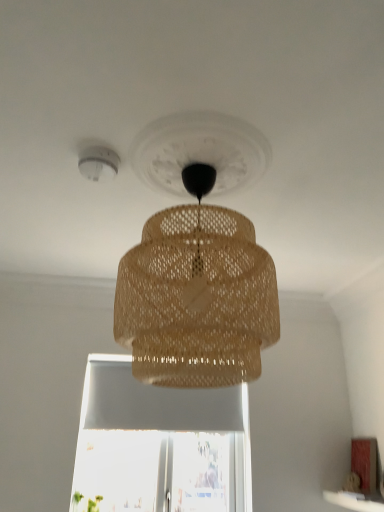
Image resolution: width=384 pixels, height=512 pixels. What do you see at coordinates (197, 295) in the screenshot?
I see `brown woven lampshade at center` at bounding box center [197, 295].

Identify the location of white matte window sill at lower right. (356, 501).

Identify the location of white plastic smoke detector at upper left. (98, 163).

From a real-world perspective, does brown woven lampshade at center stand above white matte window sill at lower right?

Yes, from a real-world perspective, brown woven lampshade at center is on top of white matte window sill at lower right.

Does point (249, 224) come in front of point (363, 508)?

Yes, point (249, 224) is in front of point (363, 508).

From the image's perspective, which one is positioned higher, white matte window sill at lower right or white plastic smoke detector at upper left?

white plastic smoke detector at upper left appears higher in the image.

From a real-world perspective, between white matte window sill at lower right and white plastic smoke detector at upper left, who is vertically higher?

white plastic smoke detector at upper left, from a real-world perspective.

Considering the sizes of white matte window sill at lower right and white plastic smoke detector at upper left in the image, is white matte window sill at lower right wider or thinner than white plastic smoke detector at upper left?

Clearly, white matte window sill at lower right has more width compared to white plastic smoke detector at upper left.

How much distance is there between white plastic smoke detector at upper left and brown woven lampshade at center?

A distance of 57.53 centimeters exists between white plastic smoke detector at upper left and brown woven lampshade at center.

Between white plastic smoke detector at upper left and brown woven lampshade at center, which one has smaller width?

white plastic smoke detector at upper left is thinner.

Is white plastic smoke detector at upper left next to brown woven lampshade at center?

white plastic smoke detector at upper left is not next to brown woven lampshade at center, and they're not touching.

From the picture: Is white plastic smoke detector at upper left positioned in front of brown woven lampshade at center?

No, the depth of white plastic smoke detector at upper left is greater than that of brown woven lampshade at center.

Considering the sizes of objects white matte window sill at lower right and brown woven lampshade at center in the image provided, who is taller, white matte window sill at lower right or brown woven lampshade at center?

Standing taller between the two is brown woven lampshade at center.

Where is `lamp above the white matte window sill at lower right (from a real-world perspective)`? This screenshot has height=512, width=384. lamp above the white matte window sill at lower right (from a real-world perspective) is located at coordinates (197, 295).

Relative to brown woven lampshade at center, is white matte window sill at lower right in front or behind?

white matte window sill at lower right is behind brown woven lampshade at center.

Is white matte window sill at lower right completely or partially outside of brown woven lampshade at center?

white matte window sill at lower right lies outside brown woven lampshade at center's area.

Is brown woven lampshade at center positioned with its back to white plastic smoke detector at upper left?

No, white plastic smoke detector at upper left is not at the back of brown woven lampshade at center.

Is point (266, 252) closer or farther from the camera than point (92, 170)?

Clearly, point (266, 252) is more distant from the camera than point (92, 170).

From a real-world perspective, relative to white plastic smoke detector at upper left, is brown woven lampshade at center vertically above or below?

brown woven lampshade at center is below white plastic smoke detector at upper left.

At what (x,y) coordinates should I click in order to perform the action: click on lighting in front of the white matte window sill at lower right. Please return your answer as a coordinate pair (x, y). The image size is (384, 512). Looking at the image, I should click on (98, 163).

From the picture: Which is in front, white plastic smoke detector at upper left or white matte window sill at lower right?

white plastic smoke detector at upper left is closer to the camera.

Looking at this image, which object is positioned more to the right, white plastic smoke detector at upper left or white matte window sill at lower right?

white matte window sill at lower right.

Is white plastic smoke detector at upper left in contact with white matte window sill at lower right?

No, white plastic smoke detector at upper left is not making contact with white matte window sill at lower right.

The image size is (384, 512). I want to click on lamp in front of the white matte window sill at lower right, so click(x=197, y=295).

The image size is (384, 512). What are the coordinates of `window sill below the white plastic smoke detector at upper left (from the image's perspective)` in the screenshot? It's located at (356, 501).

In the scene shown: Which object lies further to the anchor point brown woven lampshade at center, white plastic smoke detector at upper left or white matte window sill at lower right?

The object further to brown woven lampshade at center is white matte window sill at lower right.

Estimate the real-world distances between objects in this image. Which object is closer to white matte window sill at lower right, white plastic smoke detector at upper left or brown woven lampshade at center?

Based on the image, brown woven lampshade at center appears to be nearer to white matte window sill at lower right.

From the image, which object appears to be nearer to white plastic smoke detector at upper left, white matte window sill at lower right or brown woven lampshade at center?

brown woven lampshade at center lies closer to white plastic smoke detector at upper left than the other object.

Estimate the real-world distances between objects in this image. Which object is further from white plastic smoke detector at upper left, brown woven lampshade at center or white matte window sill at lower right?

white matte window sill at lower right is positioned further to the anchor white plastic smoke detector at upper left.

Looking at this image, estimate the real-world distances between objects in this image. Which object is closer to white matte window sill at lower right, brown woven lampshade at center or white plastic smoke detector at upper left?

brown woven lampshade at center is positioned closer to the anchor white matte window sill at lower right.

Estimate the real-world distances between objects in this image. Which object is further from brown woven lampshade at center, white matte window sill at lower right or white plastic smoke detector at upper left?

white matte window sill at lower right is positioned further to the anchor brown woven lampshade at center.

The width and height of the screenshot is (384, 512). I want to click on lamp between white plastic smoke detector at upper left and white matte window sill at lower right in the vertical direction, so click(197, 295).